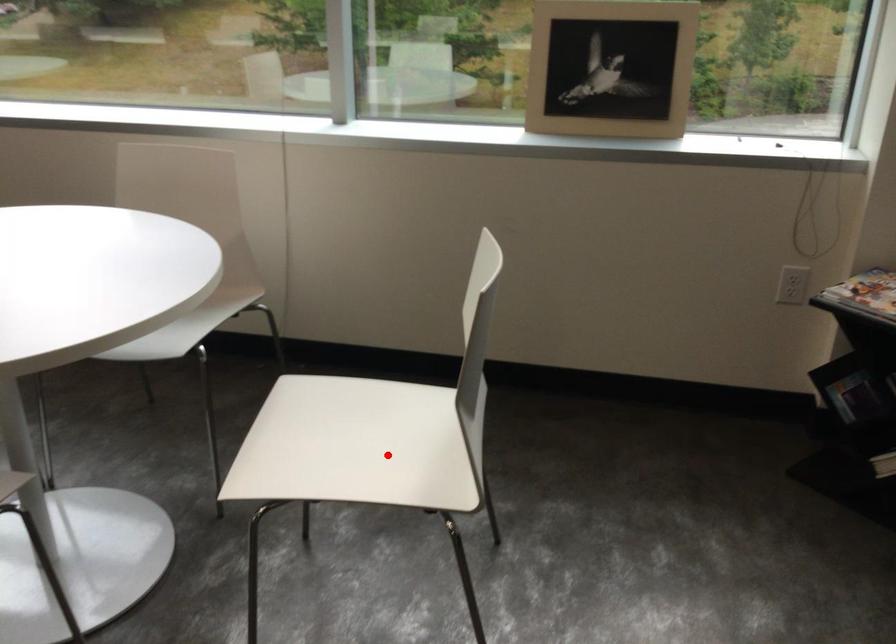
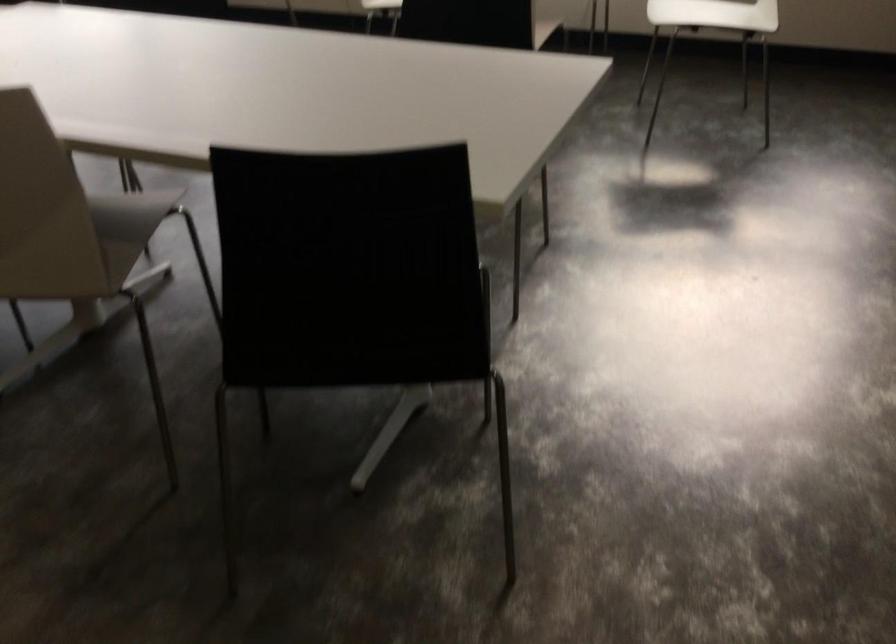
Locate, in the second image, the point that corresponds to the highlighted location in the first image.

(714, 14)